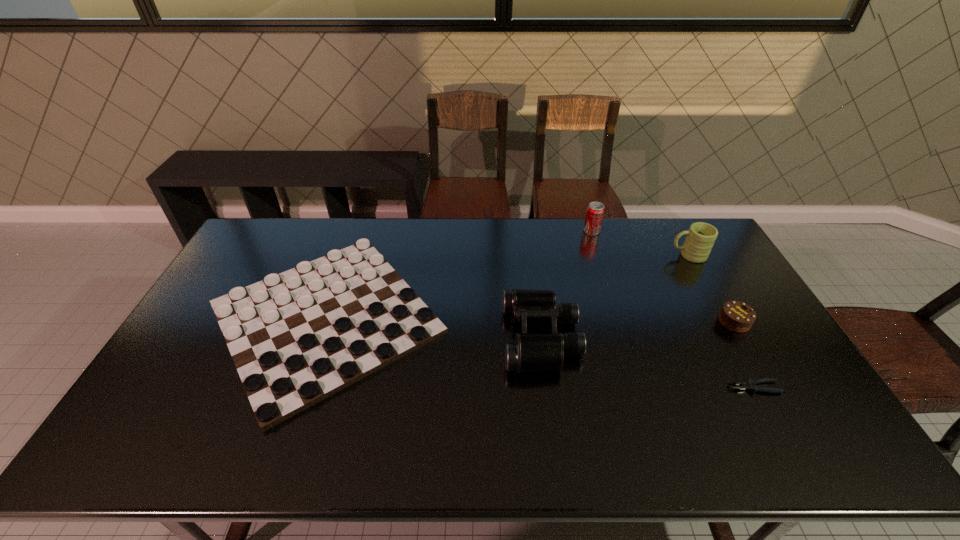
This screenshot has width=960, height=540. What are the coordinates of `object that is positioned at the far right corner` in the screenshot? It's located at (701, 236).

Where is `vacant space at the far edge of the desktop`? vacant space at the far edge of the desktop is located at coordinates (439, 219).

The height and width of the screenshot is (540, 960). What are the coordinates of `blank space at the near edge` in the screenshot? It's located at (364, 436).

Image resolution: width=960 pixels, height=540 pixels. In order to click on vacant space at the far left corner in this screenshot , I will do pos(259,236).

Locate an element on the screen. This screenshot has width=960, height=540. free space at the near left corner of the desktop is located at coordinates (149, 452).

In the image, there is a desktop. Where is `vacant space at the far right corner`? This screenshot has height=540, width=960. vacant space at the far right corner is located at coordinates (683, 237).

Where is `vacant region between the chocolate cake and the second object from left to right`? Image resolution: width=960 pixels, height=540 pixels. vacant region between the chocolate cake and the second object from left to right is located at coordinates (637, 329).

Identify the location of unoccupied area between the farthest object and the mug. (639, 243).

I want to click on free space between the mug and the chocolate cake, so click(x=711, y=288).

The image size is (960, 540). What are the coordinates of `empty space that is in between the fourth object from right to left and the chocolate cake` in the screenshot? It's located at (662, 276).